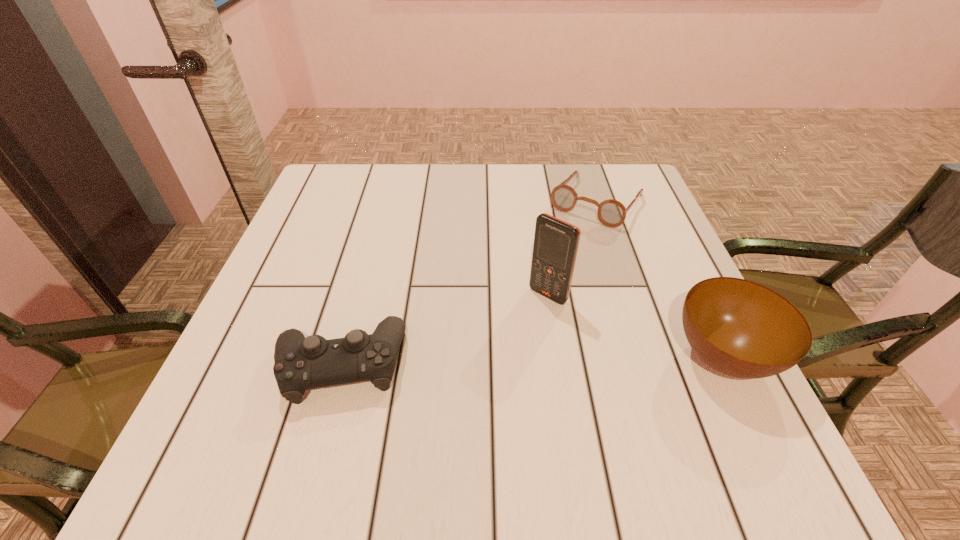
Where is `free spot between the shortest object and the control`? free spot between the shortest object and the control is located at coordinates (468, 282).

Image resolution: width=960 pixels, height=540 pixels. I want to click on free space between the third tallest object and the tallest object, so click(x=444, y=329).

This screenshot has height=540, width=960. I want to click on free spot between the bowl and the cellular telephone, so click(x=636, y=326).

Image resolution: width=960 pixels, height=540 pixels. Find the location of `free spot between the second shortest object and the third shortest object`. free spot between the second shortest object and the third shortest object is located at coordinates (531, 360).

Where is `free space that is in between the third tallest object and the cellular telephone`? free space that is in between the third tallest object and the cellular telephone is located at coordinates (444, 329).

The width and height of the screenshot is (960, 540). Identify the location of unoccupied area between the control and the shortest object. (468, 282).

In order to click on vacant space that is in between the third tallest object and the third shortest object in this screenshot , I will do `click(531, 360)`.

Identify the location of free point between the cellular telephone and the bowl. (636, 326).

Identify the location of free point between the spectacles and the third tallest object. (468, 282).

Find the location of a particular element. This screenshot has height=540, width=960. free space between the bowl and the second shortest object is located at coordinates (531, 360).